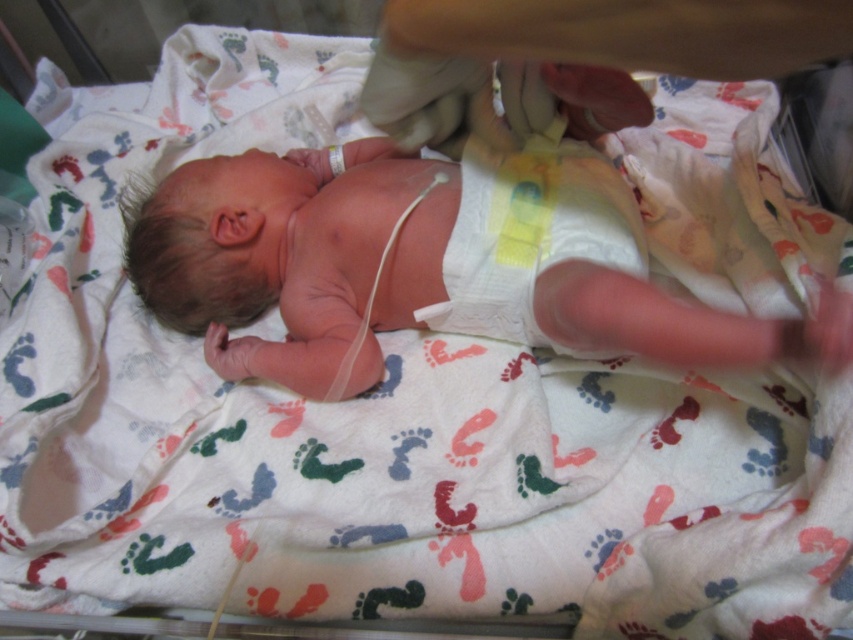
Can you confirm if smooth skin newborn at center is thinner than white paper diaper at center?

No.

Based on the photo, does smooth skin newborn at center have a smaller size compared to white paper diaper at center?

No.

Does point (606, 282) lie behind point (508, 248)?

No, it is in front of (508, 248).

At what (x,y) coordinates should I click in order to perform the action: click on smooth skin newborn at center. Please return your answer as a coordinate pair (x, y). The image size is (853, 640). Looking at the image, I should click on (426, 262).